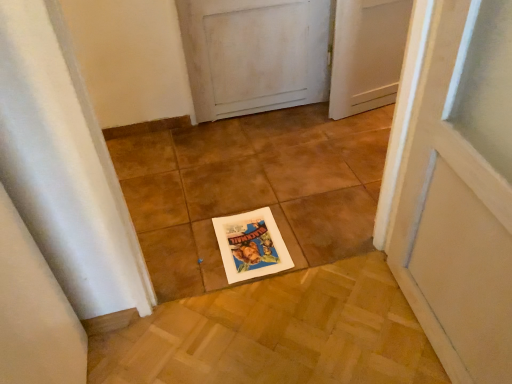
Question: From a real-world perspective, is brown tile at center positioned above or below white paper postcard at center?

Choices:
 (A) below
 (B) above

Answer: (B)

Question: In terms of size, does brown tile at center appear bigger or smaller than white paper postcard at center?

Choices:
 (A) small
 (B) big

Answer: (B)

Question: Based on their positions, is brown tile at center located to the left or right of white paper postcard at center?

Choices:
 (A) left
 (B) right

Answer: (B)

Question: Is point (217, 235) positioned closer to the camera than point (196, 200)?

Choices:
 (A) farther
 (B) closer

Answer: (B)

Question: Would you say white paper postcard at center is inside or outside brown tile at center?

Choices:
 (A) outside
 (B) inside

Answer: (A)

Question: From the image's perspective, is white paper postcard at center above or below brown tile at center?

Choices:
 (A) below
 (B) above

Answer: (A)

Question: Looking at their shapes, would you say white paper postcard at center is wider or thinner than brown tile at center?

Choices:
 (A) thin
 (B) wide

Answer: (B)